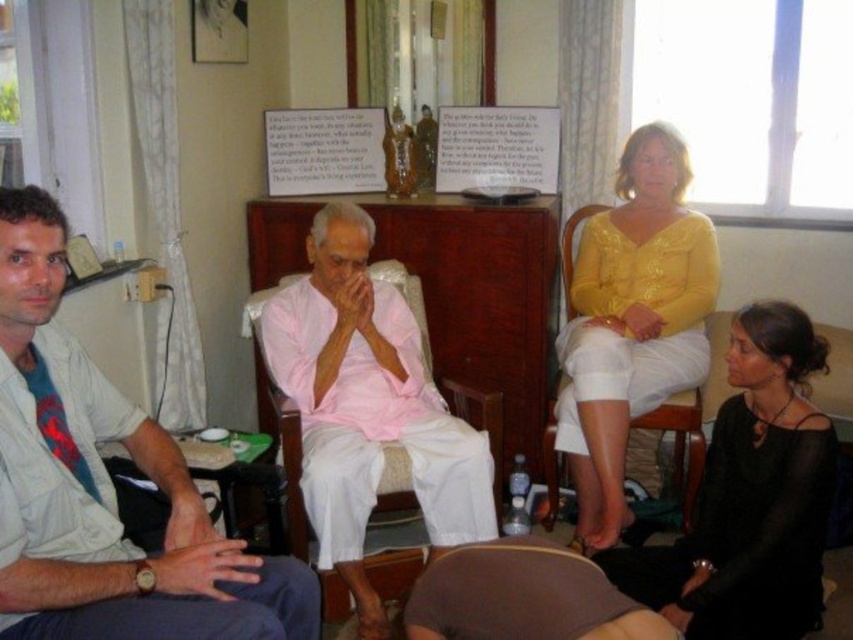
Question: Does light beige cotton shirt at center come in front of pink cotton cloth at center?

Choices:
 (A) no
 (B) yes

Answer: (B)

Question: Among these points, which one is farthest from the camera?

Choices:
 (A) (486, 584)
 (B) (735, 364)
 (C) (577, 499)
 (D) (166, 484)

Answer: (C)

Question: Estimate the real-world distances between objects in this image. Which object is closer to the pink cotton cloth at center?

Choices:
 (A) brown fabric cushion at lower center
 (B) light beige cotton shirt at center
 (C) yellow shiny blouse at upper right

Answer: (C)

Question: Considering the relative positions of black sheer dress at lower right and brown fabric cushion at lower center in the image provided, where is black sheer dress at lower right located with respect to brown fabric cushion at lower center?

Choices:
 (A) left
 (B) right

Answer: (B)

Question: Can you confirm if light beige cotton shirt at center is positioned to the right of pink cotton cloth at center?

Choices:
 (A) yes
 (B) no

Answer: (B)

Question: Which object is closer to the camera taking this photo?

Choices:
 (A) yellow shiny blouse at upper right
 (B) brown fabric cushion at lower center

Answer: (B)